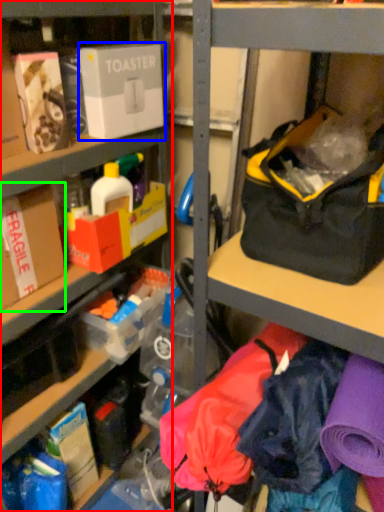
Question: Which is nearer to the shelf (highlighted by a red box)? box (highlighted by a blue box) or box (highlighted by a green box).

Choices:
 (A) box
 (B) box

Answer: (A)